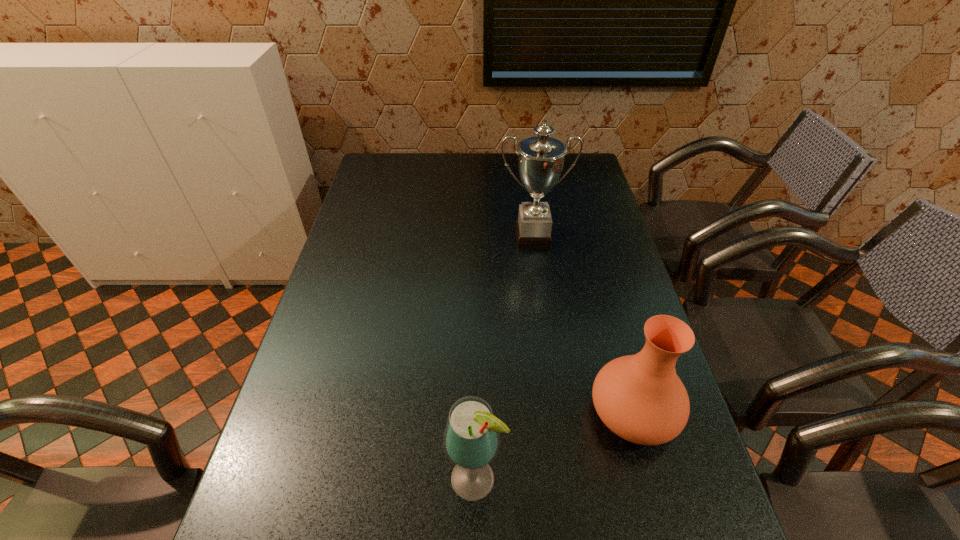
Identify which object is the nearest to the leftmost object. Please provide its 2D coordinates. Your answer should be formatted as a tuple, i.e. [(x, y)], where the tuple contains the x and y coordinates of a point satisfying the conditions above.

[(640, 398)]

Identify the location of vacant space that satisfies the following two spatial constraints: 1. on the back side of the vase; 2. on the left side of the alcohol. (476, 413).

Locate an element on the screen. vacant space that satisfies the following two spatial constraints: 1. at the front view of the farthest object; 2. on the right side of the vase is located at coordinates (557, 413).